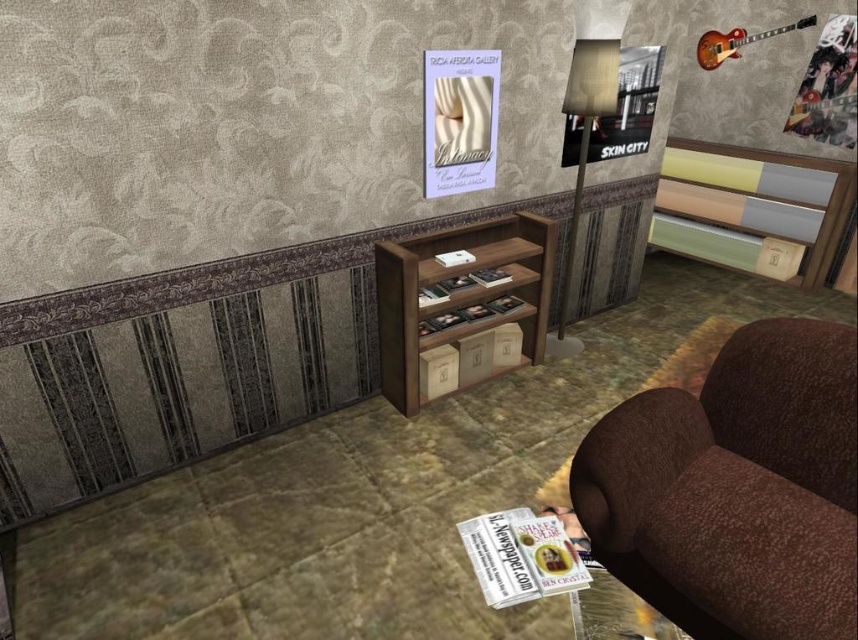
Between brown textured armchair at lower right and brown wood entertainment center at center, which one is positioned higher?

Positioned higher is brown wood entertainment center at center.

At what (x,y) coordinates should I click in order to perform the action: click on brown textured armchair at lower right. Please return your answer as a coordinate pair (x, y). Looking at the image, I should click on (734, 488).

Image resolution: width=858 pixels, height=640 pixels. I want to click on brown textured armchair at lower right, so click(734, 488).